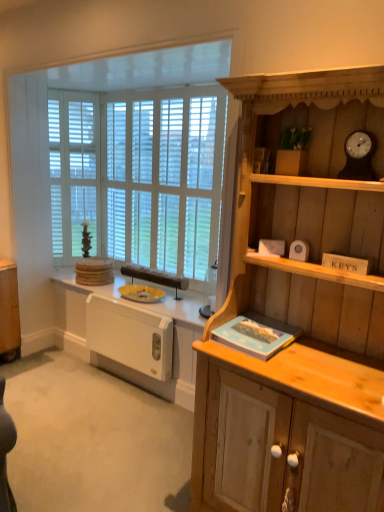
Question: Is white wooden window at upper left turned away from white wooden blinds at center?

Choices:
 (A) yes
 (B) no

Answer: (A)

Question: Is white wooden blinds at center surrounded by white wooden window at upper left?

Choices:
 (A) no
 (B) yes

Answer: (A)

Question: Are white wooden window at upper left and white wooden blinds at center far apart?

Choices:
 (A) yes
 (B) no

Answer: (B)

Question: Does white wooden window at upper left have a smaller size compared to white wooden blinds at center?

Choices:
 (A) yes
 (B) no

Answer: (B)

Question: Is white wooden window at upper left at the right side of white wooden blinds at center?

Choices:
 (A) yes
 (B) no

Answer: (B)

Question: From a real-world perspective, is white wooden window at upper left beneath white wooden blinds at center?

Choices:
 (A) yes
 (B) no

Answer: (A)

Question: Is white plastic radiator at lower left surrounding white wood blinds at left?

Choices:
 (A) yes
 (B) no

Answer: (B)

Question: Is the depth of white plastic radiator at lower left greater than that of white wood blinds at left?

Choices:
 (A) yes
 (B) no

Answer: (B)

Question: From the image's perspective, is white plastic radiator at lower left on top of white wood blinds at left?

Choices:
 (A) no
 (B) yes

Answer: (A)

Question: Can you confirm if white plastic radiator at lower left is thinner than white wood blinds at left?

Choices:
 (A) yes
 (B) no

Answer: (B)

Question: Can you confirm if white plastic radiator at lower left is bigger than white wood blinds at left?

Choices:
 (A) yes
 (B) no

Answer: (B)

Question: From the image's perspective, is white plastic radiator at lower left located beneath white wood blinds at left?

Choices:
 (A) no
 (B) yes

Answer: (B)

Question: Is white matte radiator at lower left smaller than wooden clock at upper right?

Choices:
 (A) no
 (B) yes

Answer: (A)